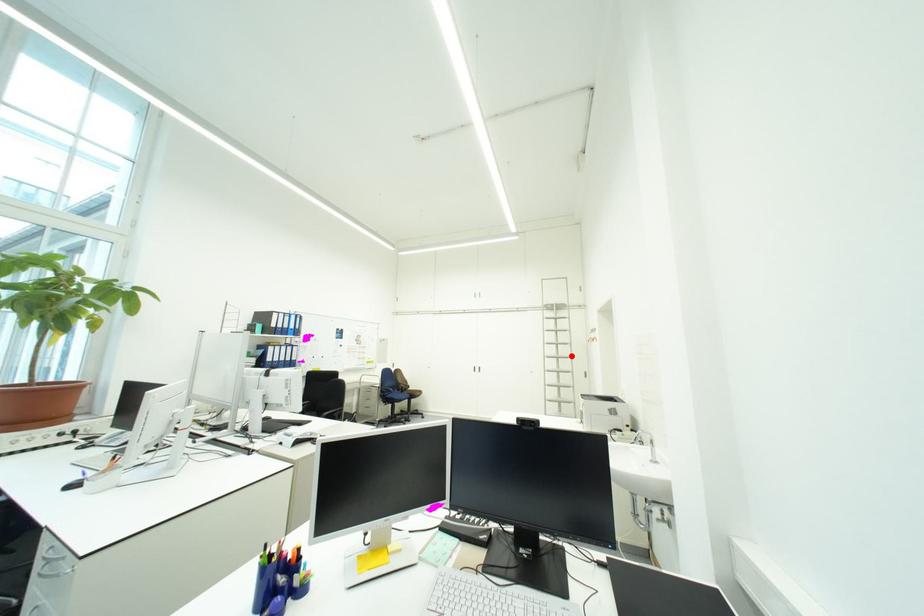
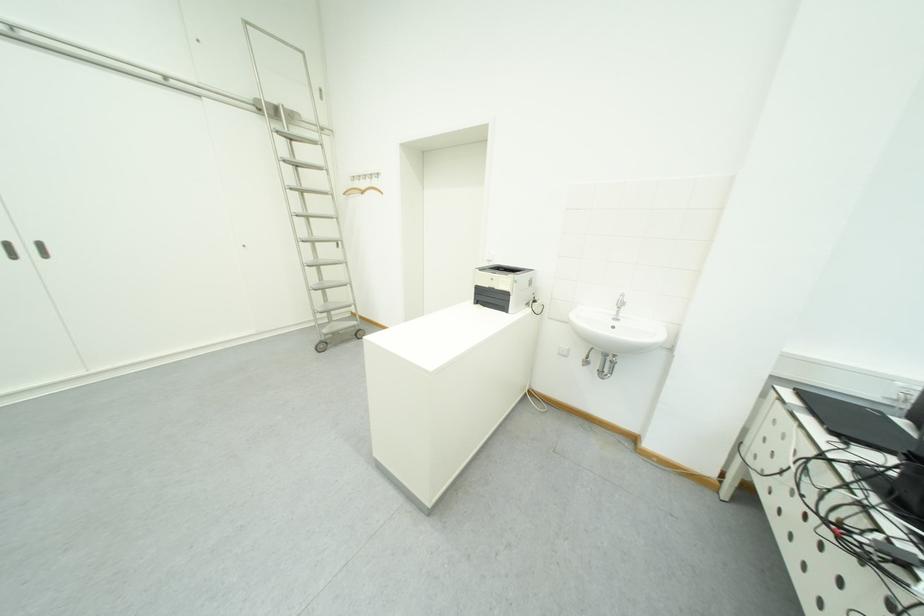
Find the pixel in the second image that matches the highlighted location in the first image.

(322, 213)